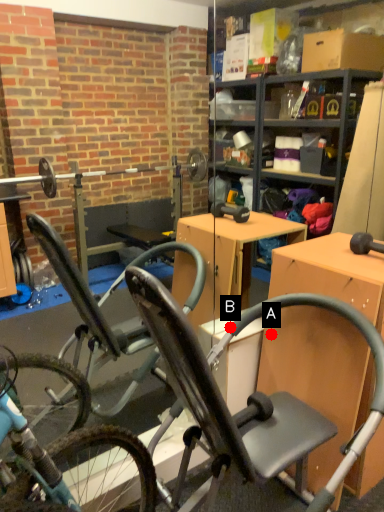
Question: Two points are circled on the image, labeled by A and B beside each circle. Which point appears farthest from the camera in this image?

Choices:
 (A) A is further
 (B) B is further

Answer: (A)